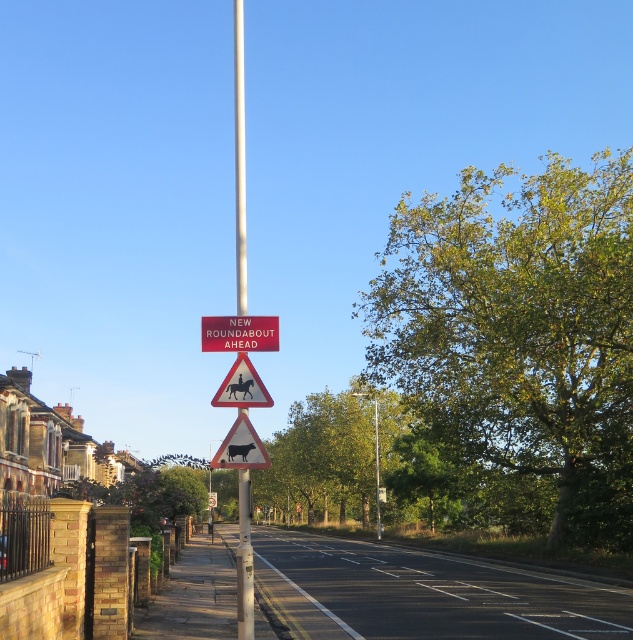
Is green leafy tree at right below green leafy tree at center?

Incorrect, green leafy tree at right is not positioned below green leafy tree at center.

Between green leafy tree at right and green leafy tree at center, which one has more height?

green leafy tree at right

Between point (587, 518) and point (298, 445), which one is positioned behind?

Positioned behind is point (298, 445).

The height and width of the screenshot is (640, 633). Identify the location of green leafy tree at right. (520, 332).

Consider the image. Which is below, green leafy tree at right or silver metallic pole at center?

Positioned lower is green leafy tree at right.

Based on the photo, can you confirm if green leafy tree at right is shorter than silver metallic pole at center?

Yes.

Based on the photo, who is more forward, [532,310] or [248,508]?

Point [248,508] is in front.

Image resolution: width=633 pixels, height=640 pixels. Find the location of `green leafy tree at right`. green leafy tree at right is located at coordinates (520, 332).

Looking at this image, is the position of green leafy tree at center less distant than that of red plastic sign at center?

No, green leafy tree at center is further to the viewer.

Does green leafy tree at center have a lesser height compared to red plastic sign at center?

No.

Looking at this image, who is more forward, (316, 484) or (241, 326)?

Point (241, 326) is in front.

Locate an element on the screen. The image size is (633, 640). green leafy tree at center is located at coordinates (330, 454).